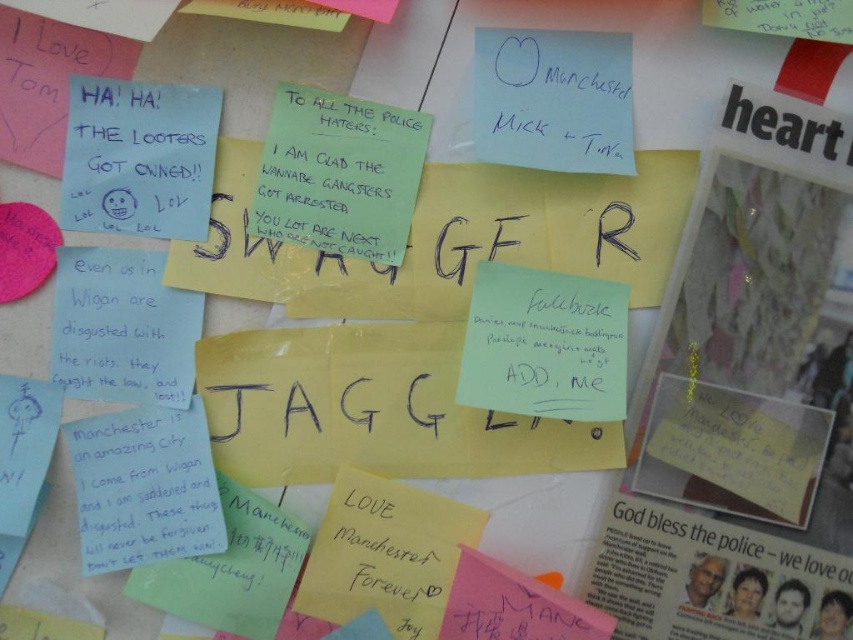
You are organizing a community board and see the yellow paper note at upper right and the green paper note at center. Which note is positioned higher on the board?

The green paper note at center is positioned higher on the board than the yellow paper note at upper right, as the yellow paper note at upper right is located below it.

You are a community organizer planning to display these notes on a new board. You need to know which note has more space to write additional messages. Which note between the yellow paper note at upper right and the green paper note at center allows for more writing space?

The yellow paper note at upper right is larger in size than the green paper note at center, so it has more space for additional writing.

You are a delivery person who needs to place a new red sticky note between the yellow paper note at upper right and the green paper note at center. The red sticky note is 2 inches wide. Can you fit it between them without overlapping either note?

The yellow paper note at upper right and green paper note at center are 16.83 inches apart from each other. Since the red sticky note is only 2 inches wide, there is enough space between them to place it without overlapping either note.